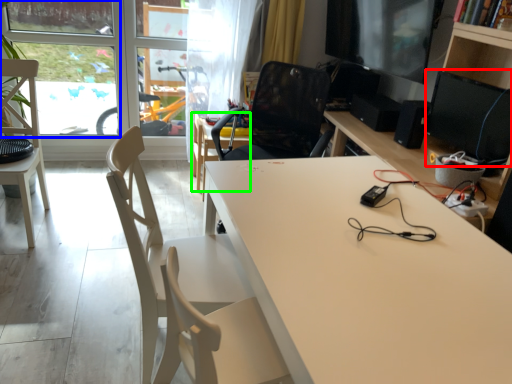
Question: Estimate the real-world distances between objects in this image. Which object is closer to computer monitor (highlighted by a red box), window screen (highlighted by a blue box) or table (highlighted by a green box)?

Choices:
 (A) window screen
 (B) table

Answer: (B)